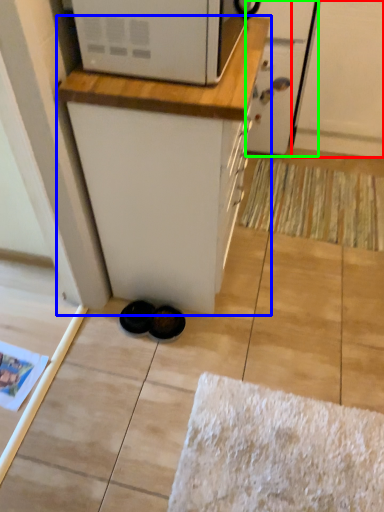
Question: Estimate the real-world distances between objects in this image. Which object is closer to screen door (highlighted by a red box), cabinetry (highlighted by a blue box) or screen door (highlighted by a green box)?

Choices:
 (A) cabinetry
 (B) screen door

Answer: (B)